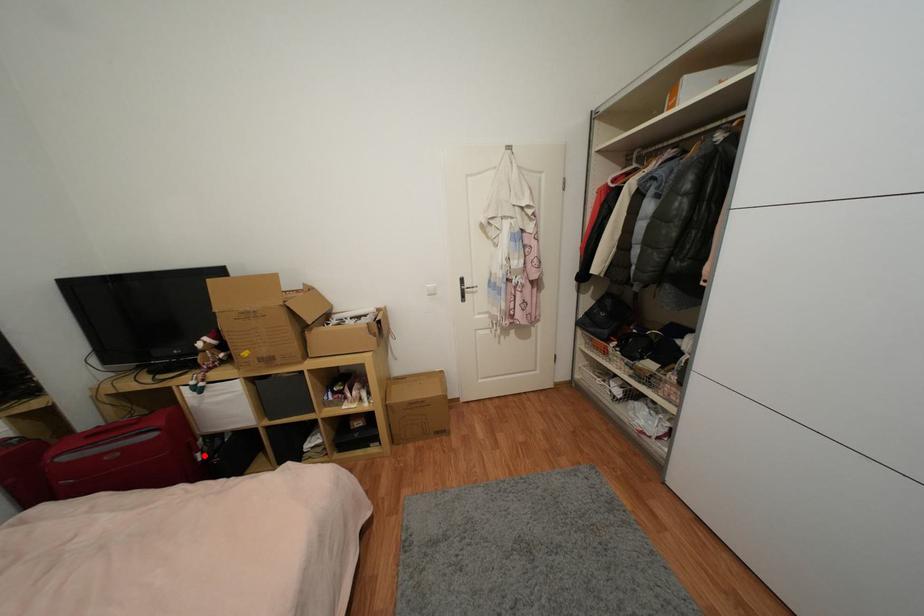
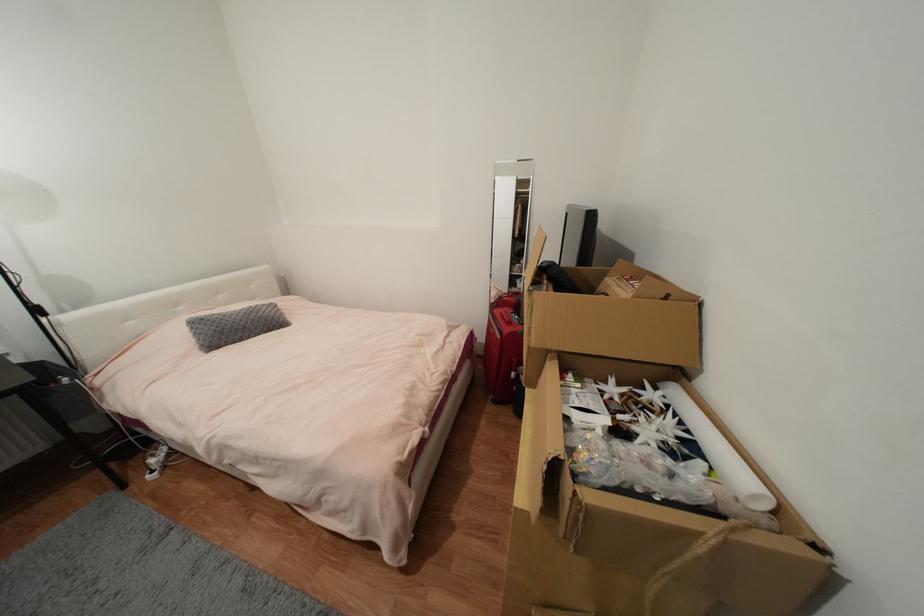
Where in the second image is the point corresponding to the highlighted location from the first image?

(517, 375)